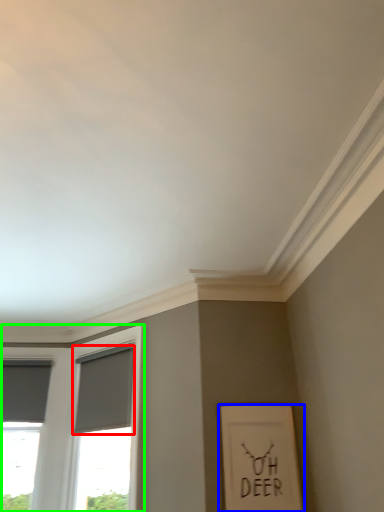
Question: Considering the real-world distances, which object is closest to curtain (highlighted by a red box)? picture frame (highlighted by a blue box) or window (highlighted by a green box).

Choices:
 (A) picture frame
 (B) window

Answer: (B)